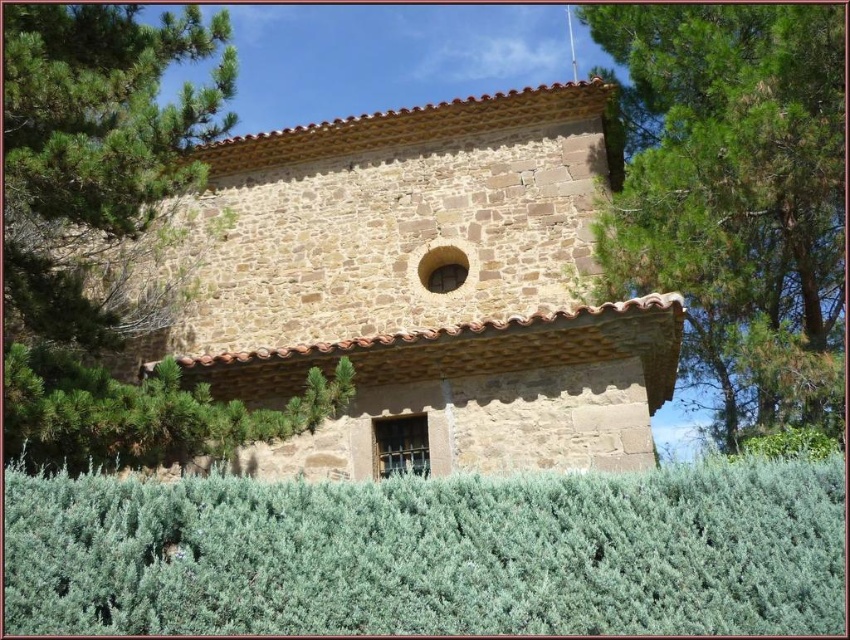
You are standing in front of the rustic stone building and want to take a photo that includes the green leafy tree at upper right. Based on its position, where should you aim your camera to ensure the tree is in the frame?

The green leafy tree at upper right is located at point 0.306 on the x and 0.866 on the y axis. To include it in the photo, aim your camera towards the upper right area of the building, specifically targeting the coordinates provided.

You are standing in front of the rustic stone building and want to know if the green leafy tree at upper left is within a 100 feet safety zone. Can you confirm?

The green leafy tree at upper left is 79.11 feet away from the viewer, so it is within the 100 feet safety zone.

From the picture: You are a gardener planning to trim the green shrubbery at center and the green leafy tree at upper left. Based on their sizes, which one might require more time to trim?

The green shrubbery at center might require more time to trim since it might be wider than the green leafy tree at upper left according to their sizes.